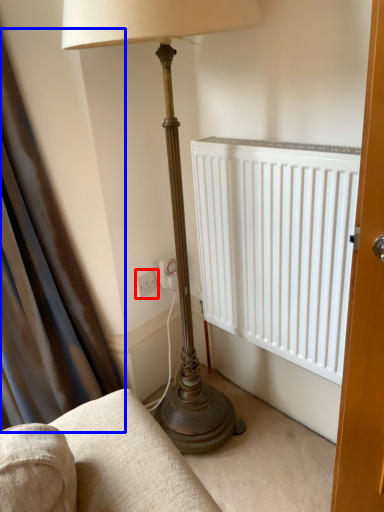
Question: Among these objects, which one is nearest to the camera, electric outlet (highlighted by a red box) or curtain (highlighted by a blue box)?

Choices:
 (A) electric outlet
 (B) curtain

Answer: (B)